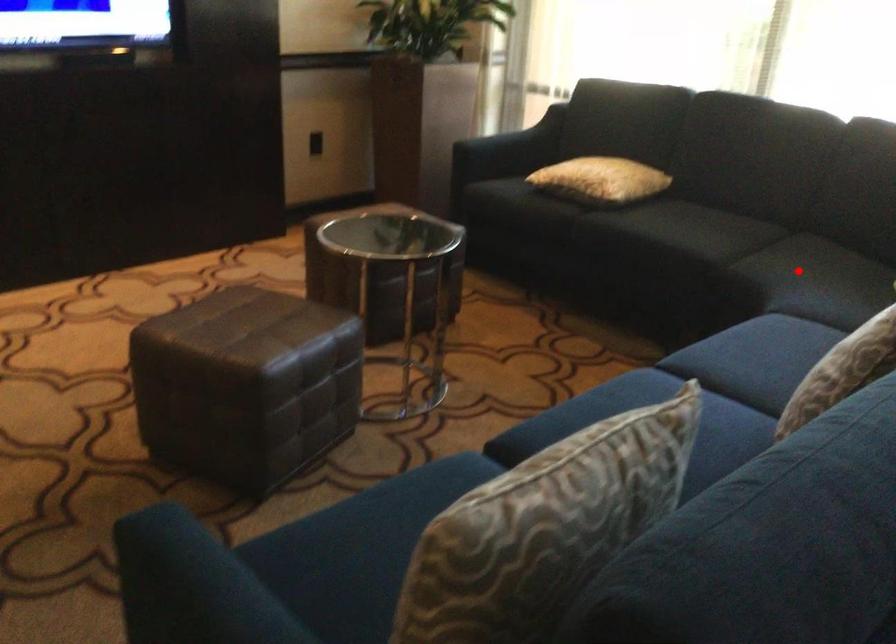
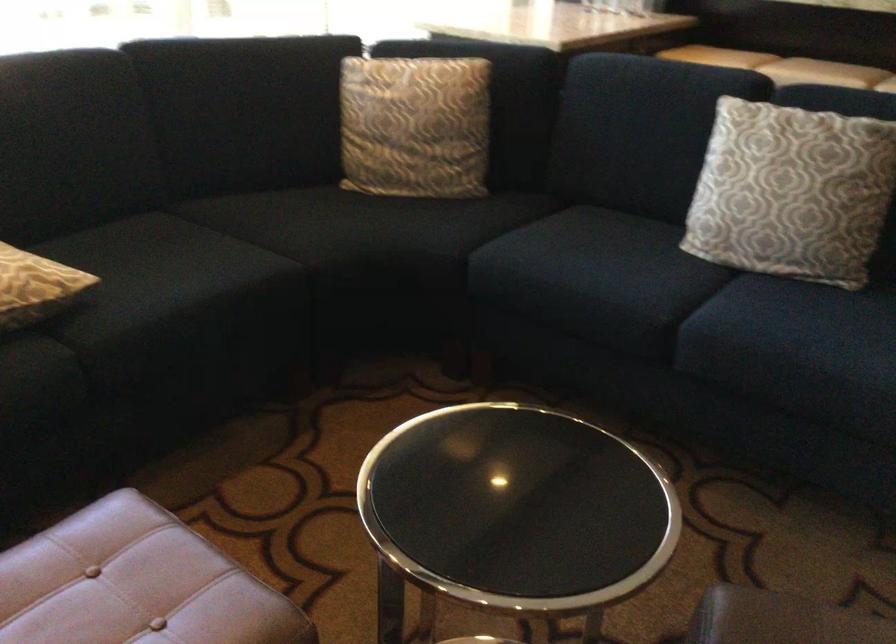
Find the pixel in the second image that matches the highlighted location in the first image.

(348, 227)